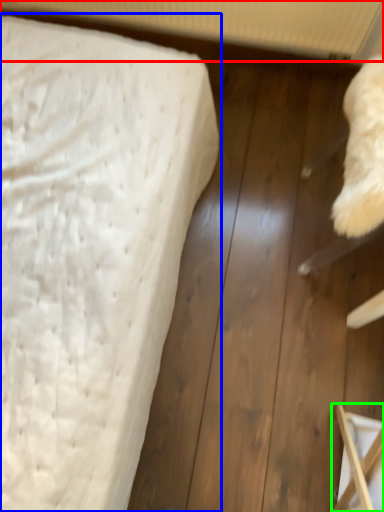
Question: Considering the real-world distances, which object is farthest from radiator (highlighted by a red box)? bed (highlighted by a blue box) or furniture (highlighted by a green box)?

Choices:
 (A) bed
 (B) furniture

Answer: (B)